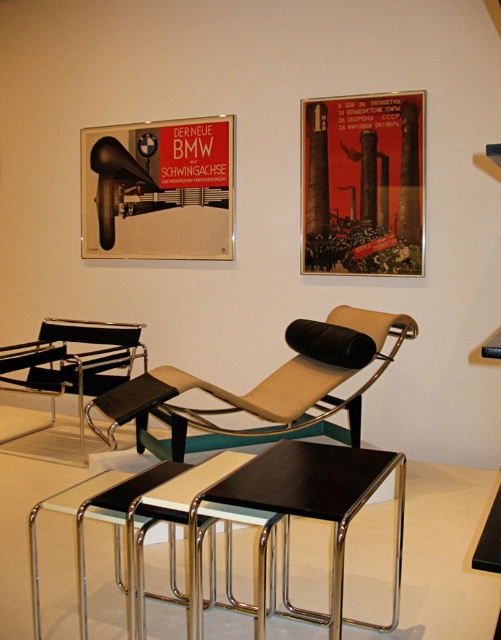
Question: Which object appears farthest from the camera in this image?

Choices:
 (A) black leather chair at left
 (B) black glossy table at center
 (C) beige leather chaise lounge at center

Answer: (A)

Question: Does beige leather chaise lounge at center have a greater width compared to black leather chair at left?

Choices:
 (A) no
 (B) yes

Answer: (B)

Question: Is matte black speaker at upper left below black leather chair at left?

Choices:
 (A) yes
 (B) no

Answer: (B)

Question: Is black glossy table at center closer to camera compared to black leather chair at left?

Choices:
 (A) yes
 (B) no

Answer: (A)

Question: Which point is farther from the camera taking this photo?

Choices:
 (A) (192, 532)
 (B) (208, 209)
 (C) (387, 323)
 (D) (53, 348)

Answer: (D)

Question: Which is nearer to the red paper poster at upper center?

Choices:
 (A) matte black speaker at upper left
 (B) black glossy table at center
 (C) beige leather chaise lounge at center
 (D) black leather chair at left

Answer: (A)